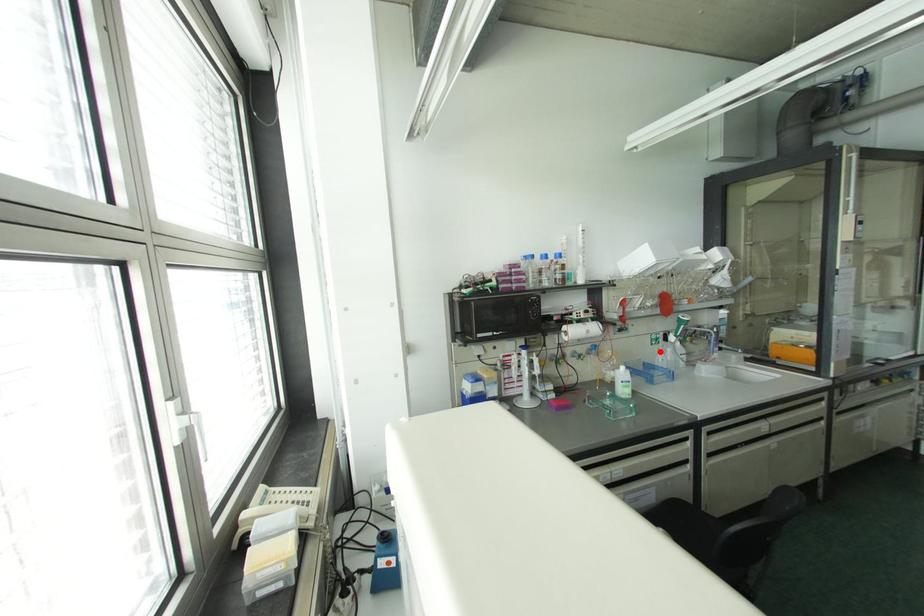
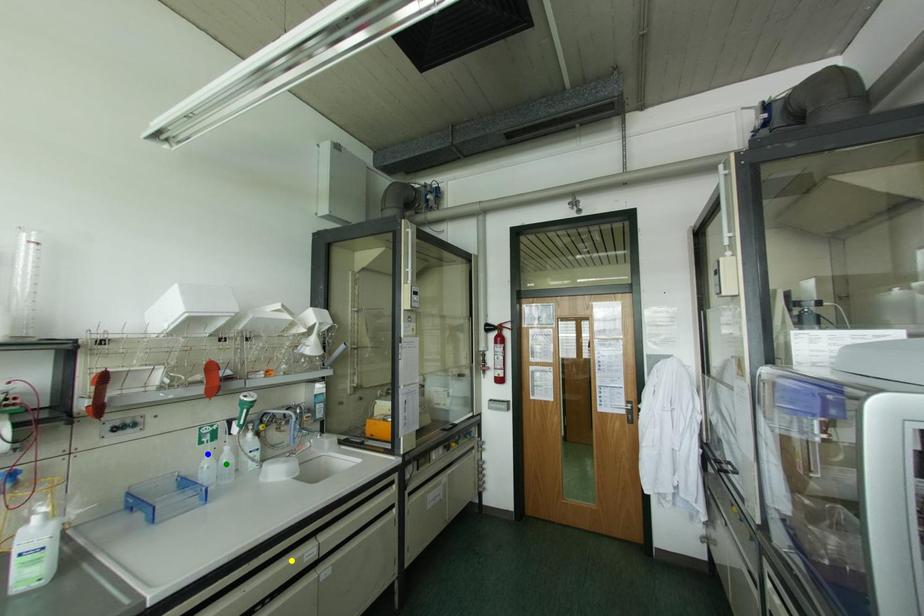
Question: I am providing you with two images of the same scene from different viewpoints. A red point is marked on the first image. You are given multiple points on the second image. Which mark in image 2 goes with the point in image 1?

Choices:
 (A) yellow point
 (B) green point
 (C) blue point

Answer: (C)